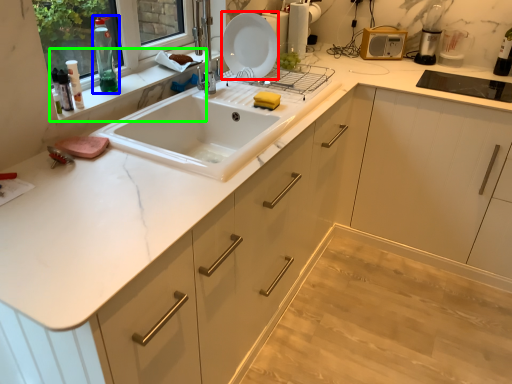
Question: Which is farther away from plate (highlighted by a red box)? bottle (highlighted by a blue box) or window sill (highlighted by a green box)?

Choices:
 (A) bottle
 (B) window sill

Answer: (A)